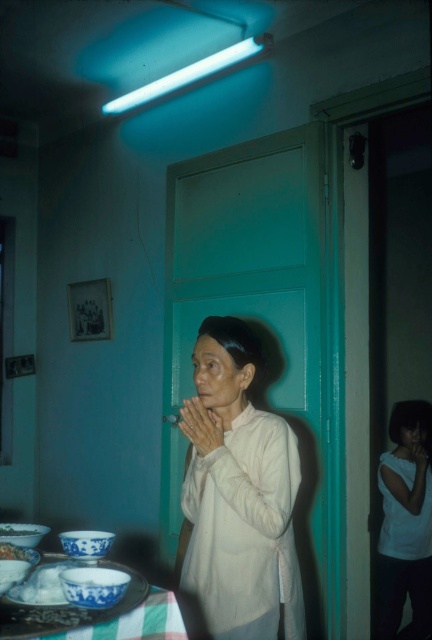
Can you confirm if white matte shirt at center is bigger than blue porcelain bowl at lower left?

Yes, white matte shirt at center is bigger than blue porcelain bowl at lower left.

Does point (259, 502) come farther from viewer compared to point (26, 556)?

Yes, it is.

Locate an element on the screen. white matte shirt at center is located at coordinates (238, 493).

Can you confirm if white porcelain bowl at lower left is positioned to the right of blue porcelain bowl at lower left?

No, white porcelain bowl at lower left is not to the right of blue porcelain bowl at lower left.

The height and width of the screenshot is (640, 432). What do you see at coordinates (22, 529) in the screenshot?
I see `white porcelain bowl at lower left` at bounding box center [22, 529].

Identify the location of white porcelain bowl at lower left. This screenshot has height=640, width=432. (22, 529).

Describe the element at coordinates (238, 493) in the screenshot. I see `white matte shirt at center` at that location.

Who is lower down, white matte shirt at center or white porcelain bowl at lower left?

white porcelain bowl at lower left is below.

Identify the location of white matte shirt at center. Image resolution: width=432 pixels, height=640 pixels. (238, 493).

You are a GUI agent. You are given a task and a screenshot of the screen. Output one action in this format:
    pyautogui.click(x=<x>, y=<y>)
    Task: Click on the white matte shirt at center
    Image resolution: width=432 pixels, height=640 pixels.
    Given the screenshot: What is the action you would take?
    pyautogui.click(x=238, y=493)